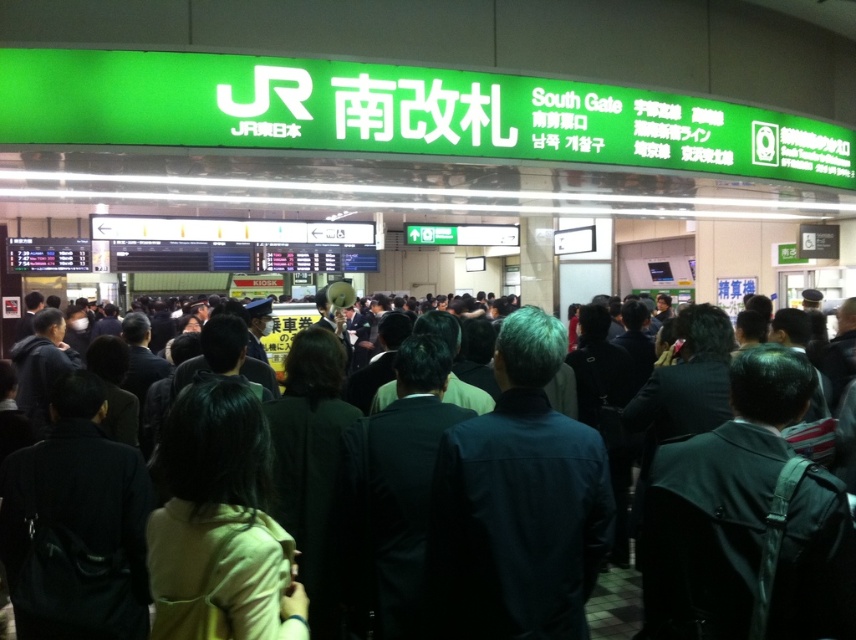
Question: Can you confirm if dark blue jacket at center is positioned to the right of dark blue suit at center?

Choices:
 (A) yes
 (B) no

Answer: (A)

Question: Is dark blue jacket at center thinner than dark blue suit at center?

Choices:
 (A) no
 (B) yes

Answer: (A)

Question: Which of the following is the closest to the observer?

Choices:
 (A) dark blue suit at center
 (B) dark blue jacket at center

Answer: (B)

Question: Does dark blue jacket at center appear on the left side of dark blue suit at center?

Choices:
 (A) yes
 (B) no

Answer: (B)

Question: Which of the following is the farthest from the observer?

Choices:
 (A) dark blue suit at center
 (B) dark blue jacket at center

Answer: (A)

Question: Which point is closer to the camera?

Choices:
 (A) (113, 340)
 (B) (507, 362)

Answer: (B)